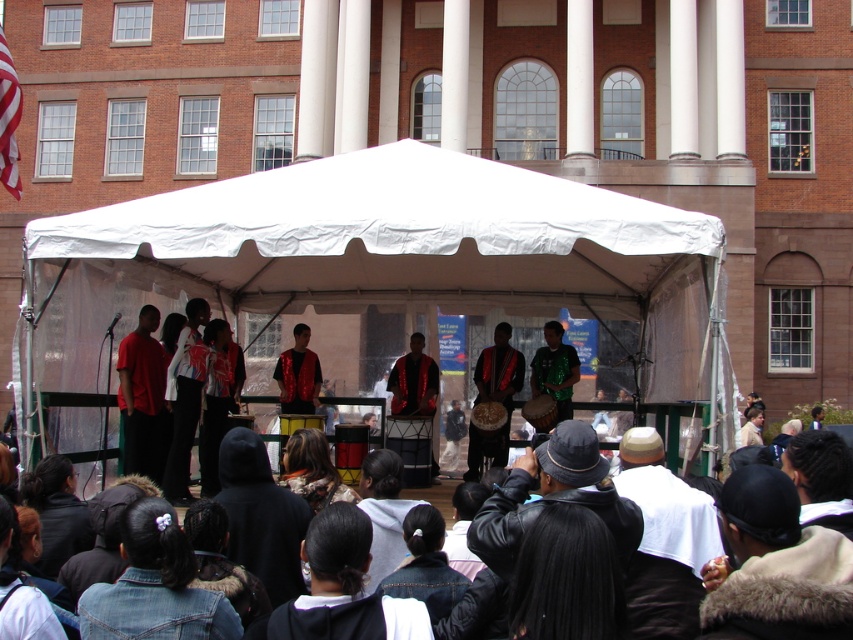
Looking at this image, you are a stagehand who needs to move the shiny green sequined shirt at center and the matte red drum at center closer together by 2 feet. Currently, how far apart are they?

The matte red drum at center is currently 6.98 feet away from the shiny green sequined shirt at center. To move them closer by 2 feet, they would need to be placed 4.98 feet apart.

You are a photographer at the event and need to capture a photo that includes both the matte red shirt at left and the shiny green sequined shirt at center. Based on their positions, which shirt should you focus on to ensure both are visible in the frame?

The matte red shirt at left is positioned under the shiny green sequined shirt at center. To ensure both are visible, focus on the shiny green sequined shirt at center as it is higher up, allowing the lower matte red shirt at left to still be in the frame.